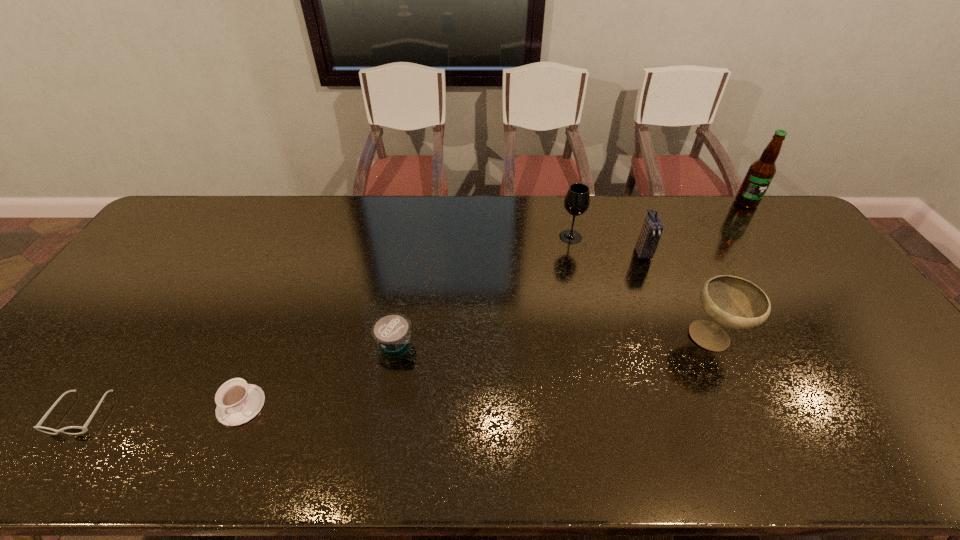
The image size is (960, 540). I want to click on object located in the far right corner section of the desktop, so click(761, 172).

Locate an element on the screen. vacant space at the far edge is located at coordinates (211, 235).

Where is `free space at the near edge`? This screenshot has height=540, width=960. free space at the near edge is located at coordinates (529, 436).

This screenshot has width=960, height=540. What are the coordinates of `free region at the right edge of the desktop` in the screenshot? It's located at coord(904,360).

Identify the location of free region at the far left corner. (186, 220).

In the image, there is a desktop. Identify the location of free space at the far right corner. Image resolution: width=960 pixels, height=540 pixels. (781, 224).

Image resolution: width=960 pixels, height=540 pixels. I want to click on vacant region between the third object from left to right and the teacup, so click(318, 374).

Where is `free point between the third object from left to right and the sunglasses`? free point between the third object from left to right and the sunglasses is located at coordinates (237, 377).

I want to click on vacant area that lies between the third object from left to right and the sunglasses, so click(237, 377).

The image size is (960, 540). Find the location of `free space between the wineglass and the shortest object`. free space between the wineglass and the shortest object is located at coordinates (325, 325).